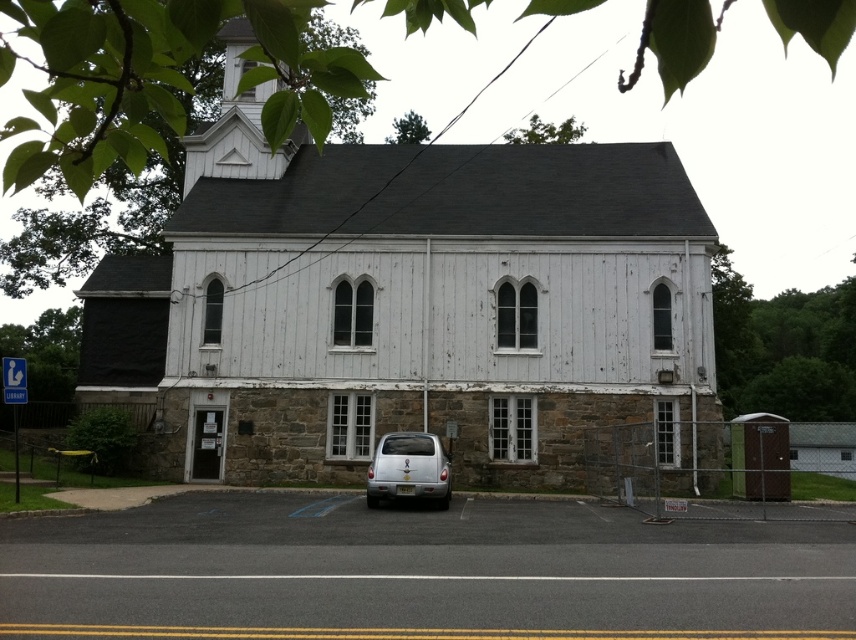
Based on the scene description, what is located at the coordinates point (405, 301)?

The white wood chapel at center is located at point (405, 301).

You are standing 5 feet away from the white wood chapel at center. Can you reach the chapel without moving closer?

The white wood chapel at center is 6.46 feet away from the viewer. Since you are standing 5 feet away, you are already closer than the required distance, so you can reach the chapel without moving closer.

You are driving a car and want to park your silver metallic car at center in front of the white wood chapel at center. Is there enough space between the chapel and the road to park the car?

The white wood chapel at center is located above the silver metallic car at center, so there is enough vertical space between them for the car to park in front of the chapel.